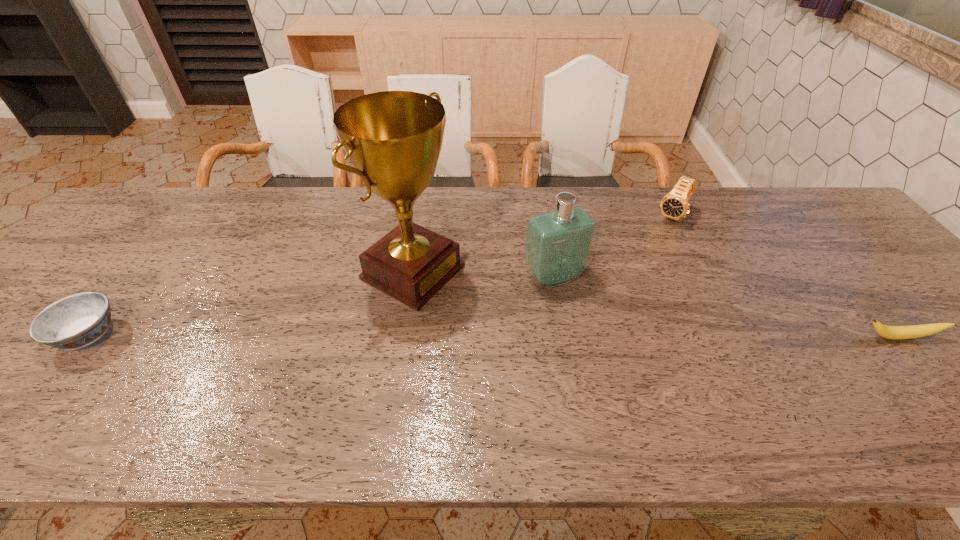
This screenshot has width=960, height=540. Find the location of `ashtray`. ashtray is located at coordinates coord(76,321).

Identify the location of banana. (914, 331).

In order to click on the tallest object in this screenshot , I will do `click(393, 139)`.

This screenshot has width=960, height=540. Find the location of `award`. award is located at coordinates (393, 139).

You are a GUI agent. You are given a task and a screenshot of the screen. Output one action in this format:
    pyautogui.click(x=<x>, y=<y>)
    Task: Click on the farthest object
    The image size is (960, 540).
    Given the screenshot: What is the action you would take?
    tap(674, 205)

The image size is (960, 540). I want to click on watch, so click(674, 205).

I want to click on perfume, so click(558, 243).

You are a GUI agent. You are given a task and a screenshot of the screen. Output one action in this format:
    pyautogui.click(x=<x>, y=<y>)
    Task: Click on the third object from left to right
    
    Given the screenshot: What is the action you would take?
    pyautogui.click(x=558, y=243)

The image size is (960, 540). I want to click on vacant space situated on the back of the leftmost object, so click(x=150, y=255).

The image size is (960, 540). I want to click on vacant space located on the upward curve of the rightmost object, so click(x=942, y=389).